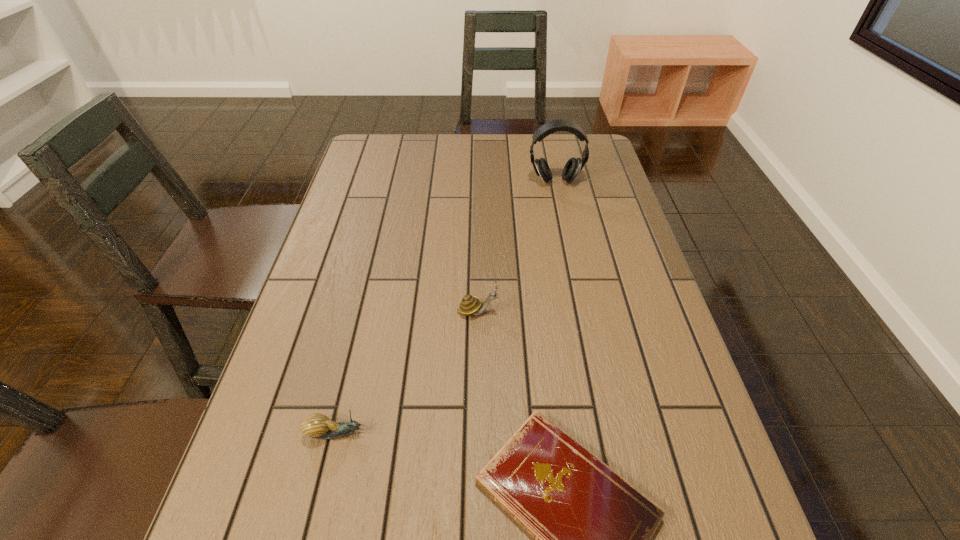
In order to click on object that is at the right edge in this screenshot , I will do `click(573, 167)`.

Find the location of a particular element. free spot at the far edge of the desktop is located at coordinates (518, 168).

Locate an element on the screen. This screenshot has width=960, height=540. vacant area at the left edge is located at coordinates [x=372, y=230].

The image size is (960, 540). I want to click on vacant point at the right edge, so [588, 178].

Identify the location of vacant space that's between the nearer escargot and the farther escargot. The image size is (960, 540). (407, 372).

Identify the location of vacant space that is in between the farther escargot and the third tallest object. Image resolution: width=960 pixels, height=540 pixels. (407, 372).

The height and width of the screenshot is (540, 960). I want to click on empty space between the earphone and the second farthest object, so click(516, 246).

At what (x,y) coordinates should I click in order to perform the action: click on object that is the third closest one to the notebook. Please return your answer as a coordinate pair (x, y). The height and width of the screenshot is (540, 960). Looking at the image, I should click on (573, 167).

Point out which object is positioned as the second nearest to the shortest object. Please provide its 2D coordinates. Your answer should be formatted as a tuple, i.e. [(x, y)], where the tuple contains the x and y coordinates of a point satisfying the conditions above.

[(470, 305)]

Identify the location of vacant area in the image that satisfies the following two spatial constraints: 1. on the ear cups of the earphone; 2. on the face of the second farthest object. (582, 311).